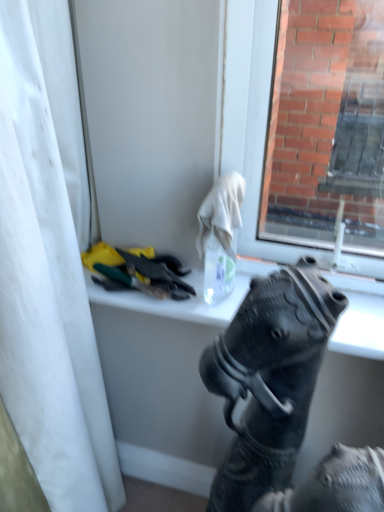
Identify the location of matte black boot at upper center. (269, 379).

The width and height of the screenshot is (384, 512). Describe the element at coordinates (269, 379) in the screenshot. I see `matte black boot at upper center` at that location.

Where is `matte black boot at upper center`? This screenshot has width=384, height=512. matte black boot at upper center is located at coordinates pyautogui.click(x=269, y=379).